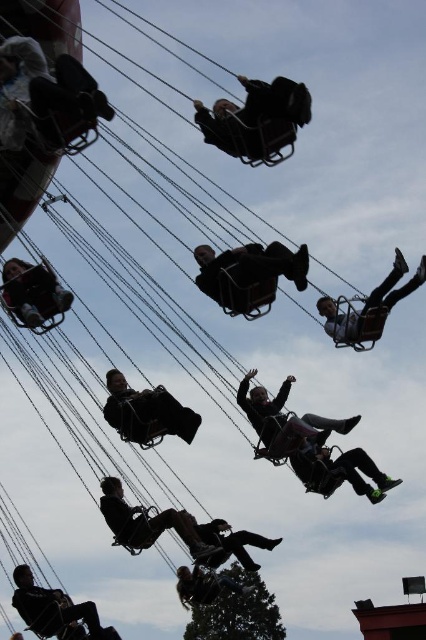
You are standing in front of the amusement park attraction and notice two points marked in the image. Which point, point [152,413] or point [218,593], is closer to your eyes?

Point [152,413] is closer to the camera than point [218,593].

In the scene shown: You are a safety inspector checking the distance between the dark gray fabric seat at center and the matte black person at left. According to safety regulations, the minimum distance between any two riders must be at least 15 meters to prevent collisions. Is the current distance compliant with the safety standards?

The dark gray fabric seat at center is 14.27 meters from the matte black person at left. Since 14.27 meters is less than the required 15 meters, the current distance does not comply with the safety standards.

You are standing in front of the amusement park swing ride and see two points marked on the ride structure. The first point is at coordinates point (155, 419) and the second is at point (14, 320). Which point is closer to you?

Point (14, 320) is closer to you because it is less further to the camera than point (155, 419).